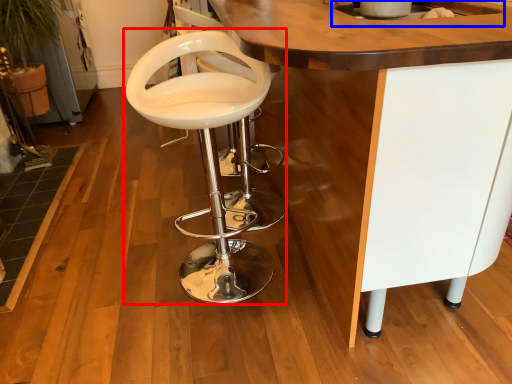
Question: Which object appears farthest to the camera in this image, chair (highlighted by a red box) or sink (highlighted by a blue box)?

Choices:
 (A) chair
 (B) sink

Answer: (B)